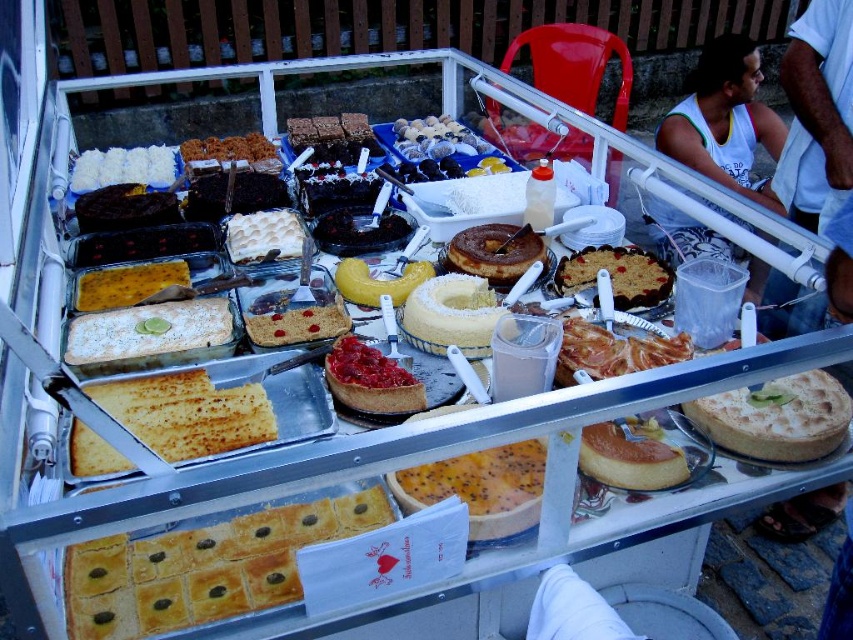
What is the 2D coordinate of the white sugared cake at center?

The white sugared cake at center is located at the 2D coordinate point of [450,314].

You are standing at the bakery stall and want to reach a specific item located at point (729, 45). If your maximum comfortable reach is 10 feet, can you comfortably reach that item without moving closer?

The distance of point (729, 45) from camera is 10.18 feet. Since your maximum comfortable reach is 10 feet, you cannot comfortably reach the item located at point (729, 45) without moving closer.

You are a customer at the bakery stall and want to choose a cake. You notice the white sugared cake at center and the golden sponge cake at center. Which one is located higher on the display?

The white sugared cake at center is located higher than the golden sponge cake at center because it is placed above it on the display.